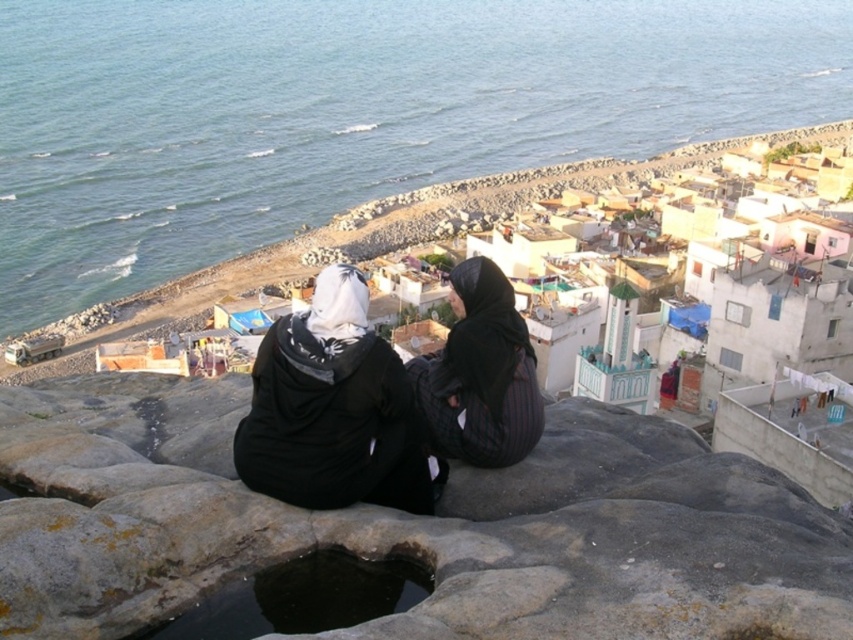
How distant is blue water at center from black matte hijab at center?

blue water at center and black matte hijab at center are 1353.67 feet apart from each other.

Who is more forward, (88, 113) or (331, 289)?

Positioned in front is point (331, 289).

The width and height of the screenshot is (853, 640). What do you see at coordinates (349, 113) in the screenshot? I see `blue water at center` at bounding box center [349, 113].

Locate an element on the screen. The width and height of the screenshot is (853, 640). blue water at center is located at coordinates (349, 113).

Who is higher up, blue water at center or dark stone hole at center?

Positioned higher is blue water at center.

Can you confirm if blue water at center is bigger than dark stone hole at center?

Yes.

Does point (321, 205) come farther from viewer compared to point (338, 579)?

Yes, point (321, 205) is behind point (338, 579).

Locate an element on the screen. Image resolution: width=853 pixels, height=640 pixels. blue water at center is located at coordinates (349, 113).

Does black matte hijab at center have a greater width compared to black textured fabric at center?

Yes, black matte hijab at center is wider than black textured fabric at center.

Is black matte hijab at center taller than black textured fabric at center?

Yes.

The height and width of the screenshot is (640, 853). Describe the element at coordinates (332, 410) in the screenshot. I see `black matte hijab at center` at that location.

Image resolution: width=853 pixels, height=640 pixels. I want to click on black matte hijab at center, so tap(332, 410).